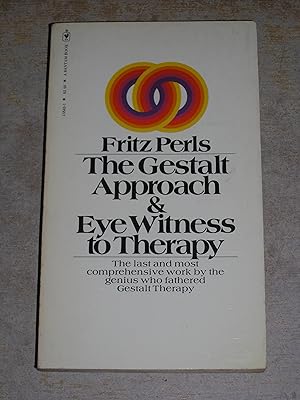
The height and width of the screenshot is (400, 300). I want to click on spine of book, so click(44, 169).